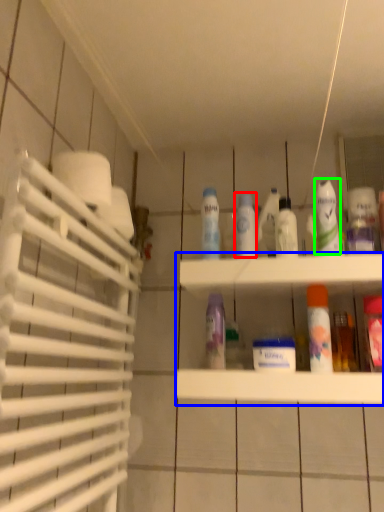
Question: Which object is positioned closest to mouthwash (highlighted by a red box)? Select from shelf (highlighted by a blue box) and cleaning product (highlighted by a green box).

Choices:
 (A) shelf
 (B) cleaning product

Answer: (B)